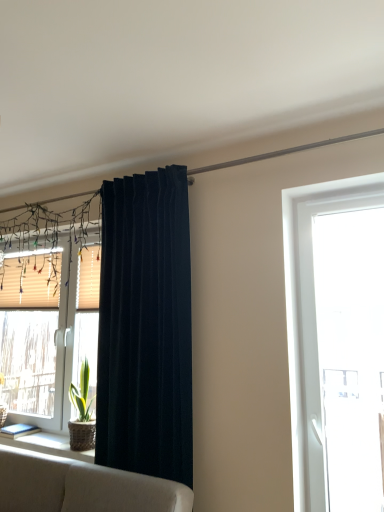
How much space does transparent glass door at right, acting as the second window starting from the left, occupy horizontally?

transparent glass door at right, acting as the second window starting from the left, is 5.68 inches wide.

What is the approximate width of beige textured blinds at left, the second window in the front-to-back sequence?

beige textured blinds at left, the second window in the front-to-back sequence, is 5.62 inches wide.

This screenshot has width=384, height=512. What are the coordinates of `beige wood shutter at left, acting as the second shutter starting from the right` in the screenshot? It's located at (31, 281).

Is beige textured blinds at left, the second window in the front-to-back sequence, taller than dark blue velvet curtain at center?

In fact, beige textured blinds at left, the second window in the front-to-back sequence, may be shorter than dark blue velvet curtain at center.

Can you tell me how much beige textured blinds at left, the second window in the front-to-back sequence, and dark blue velvet curtain at center differ in facing direction?

The angle between the facing direction of beige textured blinds at left, the second window in the front-to-back sequence, and the facing direction of dark blue velvet curtain at center is 1.55 degrees.

I want to click on the 2nd window below the dark blue velvet curtain at center (from the image's perspective), so (x=49, y=332).

Is beige textured blinds at left, which appears as the second window when viewed from the right, turned away from dark blue velvet curtain at center?

No, beige textured blinds at left, which appears as the second window when viewed from the right, is not facing away from dark blue velvet curtain at center.

Does beige textured shutter at left, acting as the first shutter starting from the right, turn towards transparent glass door at right, which appears as the second window when viewed from the back?

No.

How different are the orientations of beige textured shutter at left, marked as the 2th shutter in a back-to-front arrangement, and transparent glass door at right, the 1th window positioned from the right, in degrees?

They differ by 0.831 degrees in their facing directions.

You are a GUI agent. You are given a task and a screenshot of the screen. Output one action in this format:
    pyautogui.click(x=<x>, y=<y>)
    Task: Click on the 2nd shutter directly above the transparent glass door at right, the 1th window positioned from the right (from a real-world perspective)
    
    Given the screenshot: What is the action you would take?
    pyautogui.click(x=88, y=279)

Would you say beige wood shutter at left, acting as the second shutter starting from the right, is part of transparent glass door at right, which is the 1th window from front to back,'s contents?

No, beige wood shutter at left, acting as the second shutter starting from the right, is not inside transparent glass door at right, which is the 1th window from front to back.

Is point (284, 192) in front of point (46, 264)?

Yes, point (284, 192) is closer to viewer.

Measure the distance from transparent glass door at right, which is the 1th window from front to back, to beige wood shutter at left, the 2th shutter in the front-to-back sequence.

transparent glass door at right, which is the 1th window from front to back, is 2.12 meters away from beige wood shutter at left, the 2th shutter in the front-to-back sequence.

Is transparent glass door at right, the 1th window positioned from the right, far away from beige wood shutter at left, which ranks as the 1th shutter in back-to-front order?

Yes, transparent glass door at right, the 1th window positioned from the right, and beige wood shutter at left, which ranks as the 1th shutter in back-to-front order, are located far from each other.

Is natural wood window sill at lower left facing towards beige textured blinds at left, which appears as the second window when viewed from the right?

No.

Is point (17, 444) positioned in front of point (60, 329)?

Yes, point (17, 444) is closer to viewer.

Considering the relative sizes of natural wood window sill at lower left and beige textured blinds at left, which appears as the second window when viewed from the right, in the image provided, is natural wood window sill at lower left thinner than beige textured blinds at left, which appears as the second window when viewed from the right,?

Incorrect, the width of natural wood window sill at lower left is not less than that of beige textured blinds at left, which appears as the second window when viewed from the right.

Considering the positions of objects beige textured blinds at left, which appears as the second window when viewed from the right, and beige wood shutter at left, the 1th shutter when ordered from left to right, in the image provided, who is behind, beige textured blinds at left, which appears as the second window when viewed from the right, or beige wood shutter at left, the 1th shutter when ordered from left to right,?

beige wood shutter at left, the 1th shutter when ordered from left to right, is further away from the camera.

Is beige textured blinds at left, the second window in the front-to-back sequence, completely or partially outside of beige wood shutter at left, the 2th shutter in the front-to-back sequence?

Absolutely, beige textured blinds at left, the second window in the front-to-back sequence, is external to beige wood shutter at left, the 2th shutter in the front-to-back sequence.

Could you tell me if beige textured blinds at left, which appears as the second window when viewed from the right, is facing beige wood shutter at left, the 2th shutter in the front-to-back sequence?

Yes, beige textured blinds at left, which appears as the second window when viewed from the right, is facing beige wood shutter at left, the 2th shutter in the front-to-back sequence.

Looking at this image, from the image's perspective, relative to beige wood shutter at left, the 2th shutter in the front-to-back sequence, is beige textured blinds at left, which appears as the second window when viewed from the right, above or below?

From the image's perspective, beige textured blinds at left, which appears as the second window when viewed from the right, appears below beige wood shutter at left, the 2th shutter in the front-to-back sequence.

Does beige textured blinds at left, the second window in the front-to-back sequence, have a larger size compared to beige textured shutter at left, the first shutter positioned from the front?

Indeed, beige textured blinds at left, the second window in the front-to-back sequence, has a larger size compared to beige textured shutter at left, the first shutter positioned from the front.

Is beige textured blinds at left, acting as the first window starting from the back, oriented away from beige textured shutter at left, acting as the first shutter starting from the right?

Yes, beige textured blinds at left, acting as the first window starting from the back, is positioned with its back facing beige textured shutter at left, acting as the first shutter starting from the right.

Does point (55, 423) appear closer or farther from the camera than point (91, 256)?

Point (55, 423).

Which of these two, transparent glass door at right, acting as the second window starting from the left, or beige textured shutter at left, acting as the first shutter starting from the right, is wider?

Wider between the two is transparent glass door at right, acting as the second window starting from the left.

How many degrees apart are the facing directions of transparent glass door at right, the 1th window positioned from the right, and beige textured shutter at left, acting as the first shutter starting from the right?

0.831 degrees separate the facing orientations of transparent glass door at right, the 1th window positioned from the right, and beige textured shutter at left, acting as the first shutter starting from the right.

Would you consider transparent glass door at right, which is the 1th window from front to back, to be distant from beige textured shutter at left, the first shutter positioned from the front?

Absolutely, transparent glass door at right, which is the 1th window from front to back, is distant from beige textured shutter at left, the first shutter positioned from the front.

Is transparent glass door at right, acting as the second window starting from the left, outside of beige textured shutter at left, acting as the first shutter starting from the right?

Yes, transparent glass door at right, acting as the second window starting from the left, is located beyond the bounds of beige textured shutter at left, acting as the first shutter starting from the right.

Locate an element on the screen. Image resolution: width=384 pixels, height=512 pixels. curtain in front of the beige textured blinds at left, the second window in the front-to-back sequence is located at coordinates (146, 327).

There is a transparent glass door at right, which appears as the second window when viewed from the back. Find the location of `the 2nd shutter above it (from a real-world perspective)`. the 2nd shutter above it (from a real-world perspective) is located at coordinates (88, 279).

Which object lies further to the anchor point beige textured shutter at left, which is the 2th shutter in left-to-right order, beige wood shutter at left, the 2th shutter in the front-to-back sequence, or beige textured blinds at left, which appears as the second window when viewed from the right?

Among the two, beige textured blinds at left, which appears as the second window when viewed from the right, is located further to beige textured shutter at left, which is the 2th shutter in left-to-right order.

Looking at the image, which one is located closer to transparent glass door at right, the 1th window positioned from the right, beige wood shutter at left, acting as the second shutter starting from the right, or beige textured blinds at left, placed as the first window when sorted from left to right?

The object closer to transparent glass door at right, the 1th window positioned from the right, is beige wood shutter at left, acting as the second shutter starting from the right.

Considering their positions, is transparent glass door at right, acting as the second window starting from the left, positioned further to beige textured shutter at left, which is the 2th shutter in left-to-right order, than beige wood shutter at left, the 2th shutter in the front-to-back sequence?

Among the two, transparent glass door at right, acting as the second window starting from the left, is located further to beige textured shutter at left, which is the 2th shutter in left-to-right order.

Estimate the real-world distances between objects in this image. Which object is further from natural wood window sill at lower left, dark blue velvet curtain at center or beige textured shutter at left, marked as the 2th shutter in a back-to-front arrangement?

Based on the image, beige textured shutter at left, marked as the 2th shutter in a back-to-front arrangement, appears to be further to natural wood window sill at lower left.

Which object lies nearer to the anchor point beige wood shutter at left, acting as the second shutter starting from the right, dark blue velvet curtain at center or transparent glass door at right, acting as the second window starting from the left?

dark blue velvet curtain at center lies closer to beige wood shutter at left, acting as the second shutter starting from the right, than the other object.

From the image, which object appears to be nearer to natural wood window sill at lower left, beige wood shutter at left, acting as the second shutter starting from the right, or dark blue velvet curtain at center?

Based on the image, dark blue velvet curtain at center appears to be nearer to natural wood window sill at lower left.

Considering their positions, is natural wood window sill at lower left positioned closer to beige textured blinds at left, which appears as the second window when viewed from the right, than dark blue velvet curtain at center?

natural wood window sill at lower left.

When comparing their distances from natural wood window sill at lower left, does beige wood shutter at left, which ranks as the 1th shutter in back-to-front order, or beige textured blinds at left, which appears as the second window when viewed from the right, seem further?

Among the two, beige textured blinds at left, which appears as the second window when viewed from the right, is located further to natural wood window sill at lower left.

At what (x,y) coordinates should I click in order to perform the action: click on window sill between beige textured blinds at left, the second window in the front-to-back sequence, and transparent glass door at right, the 1th window positioned from the right. Please return your answer as a coordinate pair (x, y). The height and width of the screenshot is (512, 384). Looking at the image, I should click on [48, 445].

Locate an element on the screen. The height and width of the screenshot is (512, 384). window located between dark blue velvet curtain at center and beige textured shutter at left, the first shutter positioned from the front, in the depth direction is located at coordinates (49, 332).

This screenshot has width=384, height=512. What are the coordinates of `curtain between beige textured shutter at left, acting as the first shutter starting from the right, and natural wood window sill at lower left in the up-down direction` in the screenshot? It's located at (146, 327).

You are a GUI agent. You are given a task and a screenshot of the screen. Output one action in this format:
    pyautogui.click(x=<x>, y=<y>)
    Task: Click on the window sill between beige textured blinds at left, which appears as the second window when viewed from the right, and dark blue velvet curtain at center, in the horizontal direction
    The width and height of the screenshot is (384, 512).
    Given the screenshot: What is the action you would take?
    (48, 445)